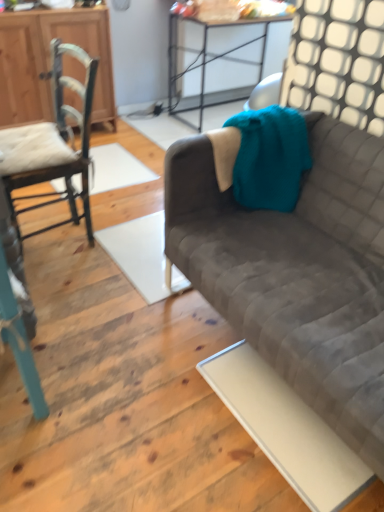
Question: From their relative heights in the image, would you say wooden cabinet at left is taller or shorter than metallic silver table at upper center?

Choices:
 (A) short
 (B) tall

Answer: (B)

Question: Would you say wooden cabinet at left is inside or outside metallic silver table at upper center?

Choices:
 (A) inside
 (B) outside

Answer: (B)

Question: Which object is the farthest from the wooden chair at left, which appears as the 2th chair when viewed from the front?

Choices:
 (A) velvet gray couch at right
 (B) teal knitted blanket at upper right
 (C) metallic silver table at upper center
 (D) teal wooden chair at left, the second chair positioned from the back
 (E) wooden cabinet at left

Answer: (C)

Question: Which of these objects is positioned farthest from the wooden cabinet at left?

Choices:
 (A) teal knitted blanket at upper right
 (B) teal wooden chair at left, the 1th chair viewed from the front
 (C) velvet gray couch at right
 (D) wooden chair at left, which appears as the 2th chair when viewed from the front
 (E) metallic silver table at upper center

Answer: (B)